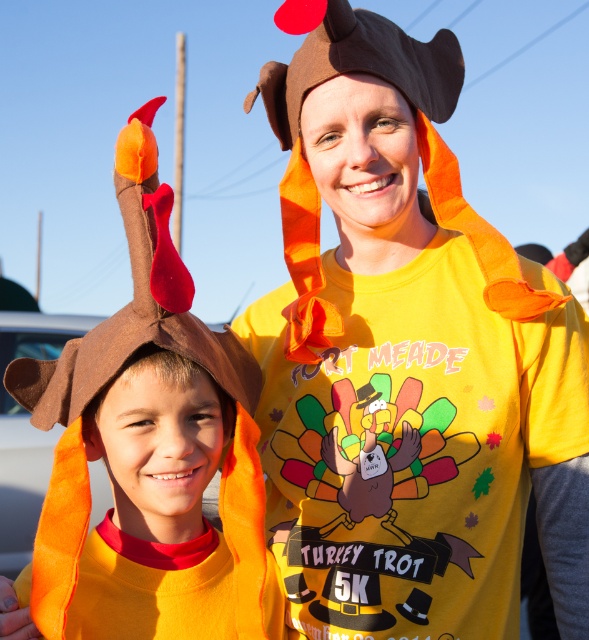
This screenshot has height=640, width=589. Identify the location of matte brown turkey hat at center. (406, 362).

You are a GUI agent. You are given a task and a screenshot of the screen. Output one action in this format:
    pyautogui.click(x=<x>, y=<y>)
    Task: Click on the matte brown turkey hat at center
    
    Given the screenshot: What is the action you would take?
    pyautogui.click(x=406, y=362)